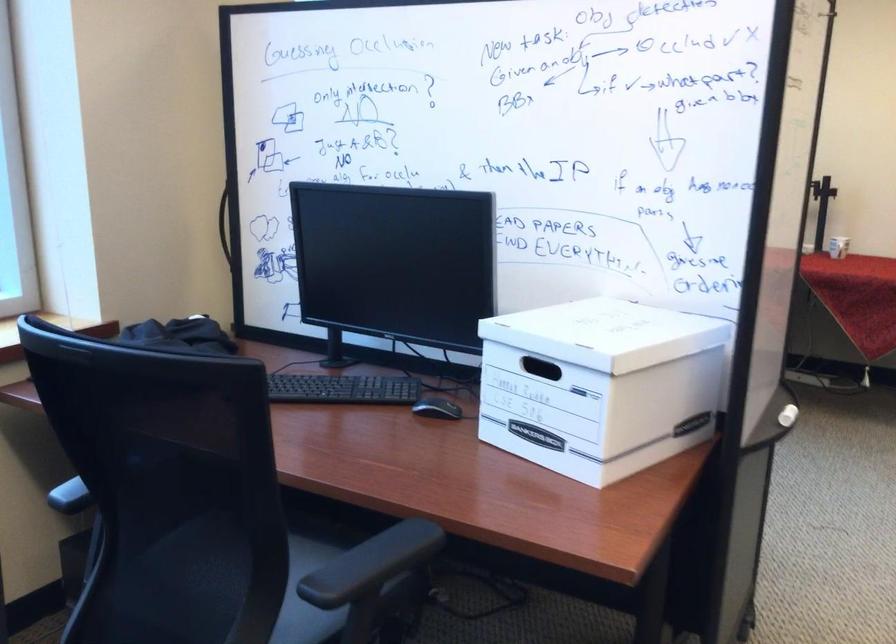
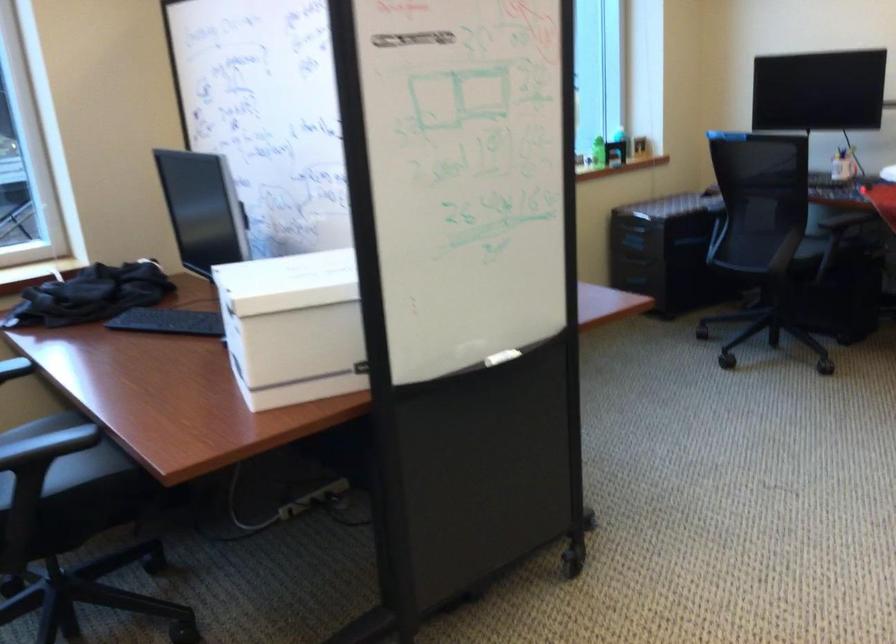
Where in the second image is the point corresponding to [797,413] from the first image?

(502, 357)